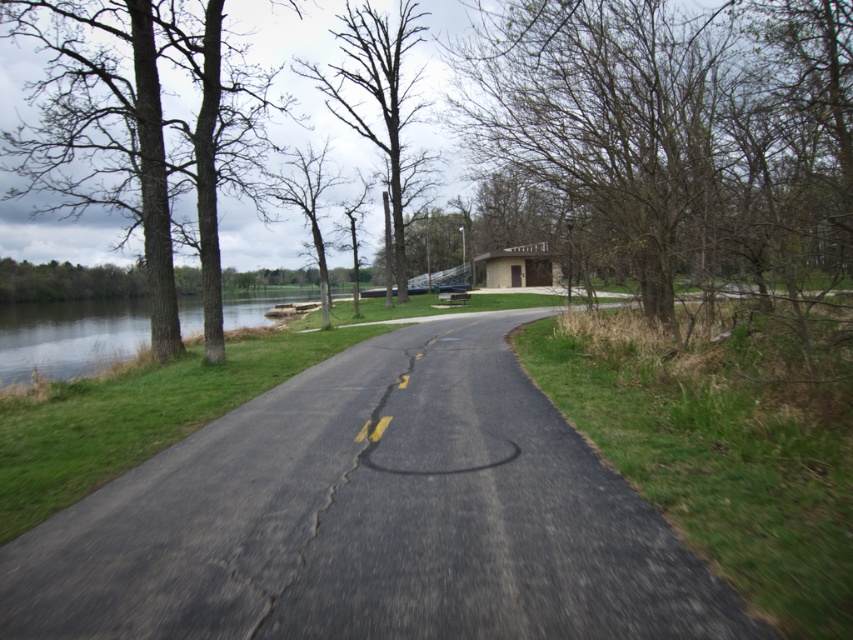
The width and height of the screenshot is (853, 640). I want to click on asphalt road at center, so click(x=372, y=518).

Looking at this image, can you confirm if asphalt road at center is thinner than brown leafless tree at upper right?

Indeed, asphalt road at center has a lesser width compared to brown leafless tree at upper right.

Find the location of a particular element. asphalt road at center is located at coordinates (372, 518).

Measure the distance from brown leafless tree at upper right to brown rough tree at left.

A distance of 25.34 meters exists between brown leafless tree at upper right and brown rough tree at left.

Is point (706, 141) less distant than point (215, 160)?

Yes, it is.

Describe the element at coordinates (677, 138) in the screenshot. I see `brown leafless tree at upper right` at that location.

Image resolution: width=853 pixels, height=640 pixels. In order to click on brown leafless tree at upper right in this screenshot , I will do [677, 138].

How distant is brown leafless tree at upper right from bare wood tree at center?

The distance of brown leafless tree at upper right from bare wood tree at center is 16.66 meters.

Is brown leafless tree at upper right taller than bare wood tree at center?

No, brown leafless tree at upper right is not taller than bare wood tree at center.

Which is behind, point (767, 77) or point (395, 173)?

Point (395, 173)

The image size is (853, 640). Identify the location of brown leafless tree at upper right. (677, 138).